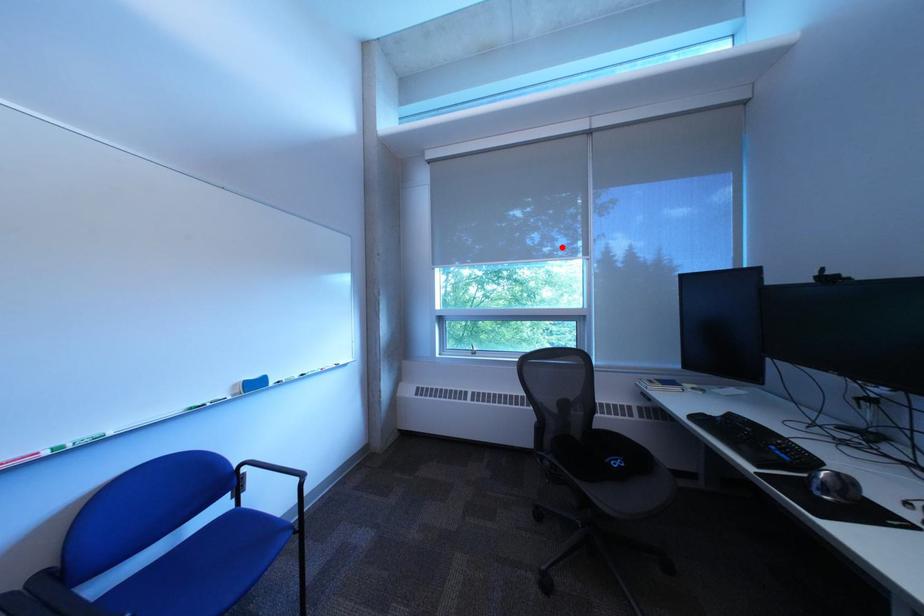
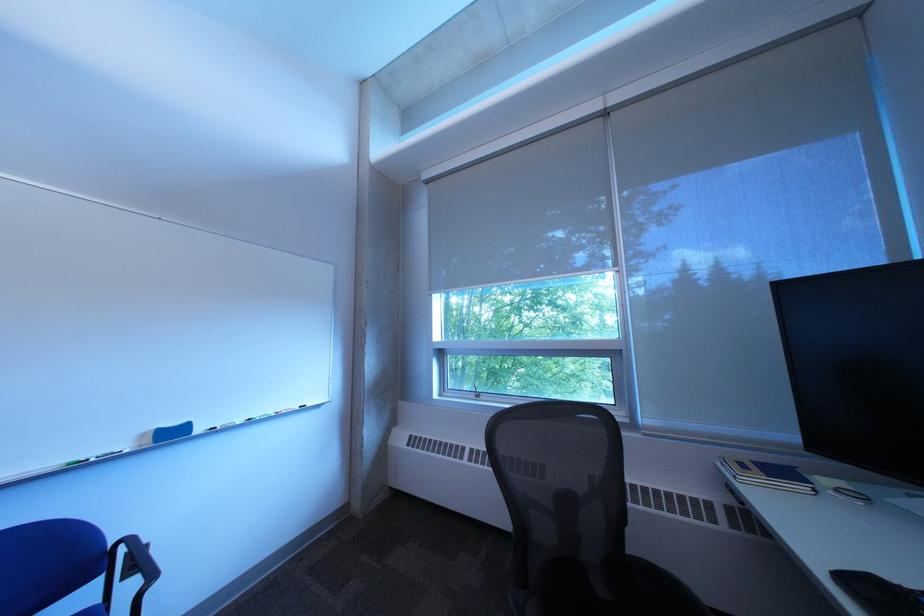
Locate, in the second image, the point that corresponds to the highlighted location in the first image.

(611, 267)